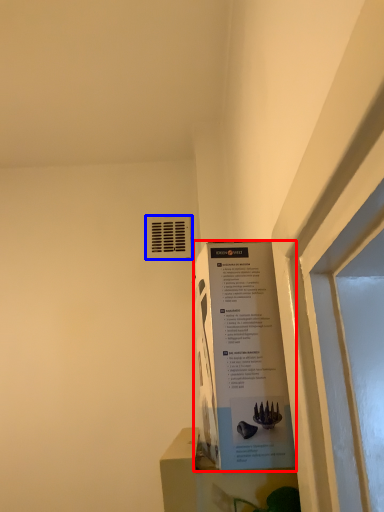
Question: Among these objects, which one is farthest to the camera, poster (highlighted by a red box) or air conditioning (highlighted by a blue box)?

Choices:
 (A) poster
 (B) air conditioning

Answer: (B)